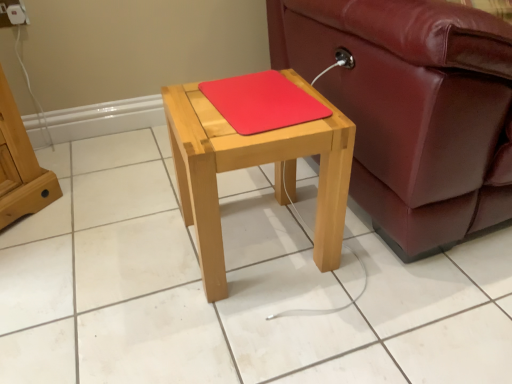
Question: Considering the relative sizes of white plastic electric outlet at upper left and natural wood table at center in the image provided, is white plastic electric outlet at upper left smaller than natural wood table at center?

Choices:
 (A) yes
 (B) no

Answer: (A)

Question: From a real-world perspective, does white plastic electric outlet at upper left stand above natural wood table at center?

Choices:
 (A) no
 (B) yes

Answer: (B)

Question: Would you say white plastic electric outlet at upper left is outside natural wood table at center?

Choices:
 (A) no
 (B) yes

Answer: (B)

Question: Is white plastic electric outlet at upper left facing away from natural wood table at center?

Choices:
 (A) no
 (B) yes

Answer: (A)

Question: Does white plastic electric outlet at upper left come in front of natural wood table at center?

Choices:
 (A) no
 (B) yes

Answer: (A)

Question: Is natural wood table at center inside the boundaries of white plastic electric outlet at upper left, or outside?

Choices:
 (A) inside
 (B) outside

Answer: (B)

Question: Considering their positions, is natural wood table at center located in front of or behind white plastic electric outlet at upper left?

Choices:
 (A) front
 (B) behind

Answer: (A)

Question: Considering the positions of natural wood table at center and white plastic electric outlet at upper left in the image, is natural wood table at center bigger or smaller than white plastic electric outlet at upper left?

Choices:
 (A) small
 (B) big

Answer: (B)

Question: Does point (278, 137) appear closer or farther from the camera than point (2, 11)?

Choices:
 (A) closer
 (B) farther

Answer: (A)

Question: Visually, is leather couch at right positioned to the left or to the right of natural wood table at center?

Choices:
 (A) right
 (B) left

Answer: (A)

Question: In terms of width, does leather couch at right look wider or thinner when compared to natural wood table at center?

Choices:
 (A) thin
 (B) wide

Answer: (B)

Question: Considering the positions of leather couch at right and natural wood table at center in the image, is leather couch at right bigger or smaller than natural wood table at center?

Choices:
 (A) big
 (B) small

Answer: (A)

Question: Considering the positions of point (328, 9) and point (212, 120), is point (328, 9) closer or farther from the camera than point (212, 120)?

Choices:
 (A) closer
 (B) farther

Answer: (B)

Question: Considering the positions of leather couch at right and white plastic electric outlet at upper left in the image, is leather couch at right wider or thinner than white plastic electric outlet at upper left?

Choices:
 (A) wide
 (B) thin

Answer: (A)

Question: From a real-world perspective, is leather couch at right above or below white plastic electric outlet at upper left?

Choices:
 (A) above
 (B) below

Answer: (B)